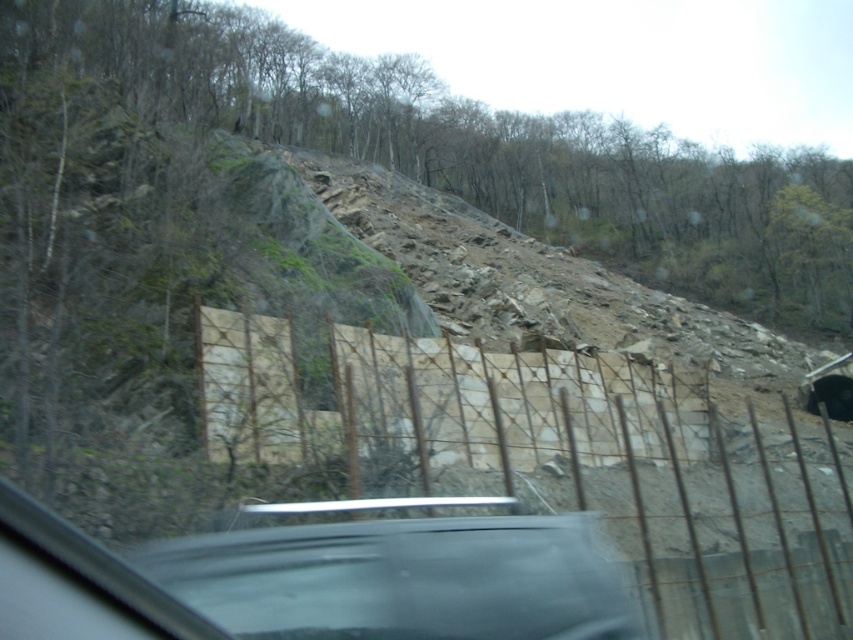
Question: Is brown woven wire fence at center above green mossy rock at upper left?

Choices:
 (A) no
 (B) yes

Answer: (A)

Question: Does brown woven wire fence at center appear on the right side of green mossy rock at upper left?

Choices:
 (A) no
 (B) yes

Answer: (B)

Question: Can you confirm if brown woven wire fence at center is positioned to the right of green mossy rock at upper left?

Choices:
 (A) yes
 (B) no

Answer: (A)